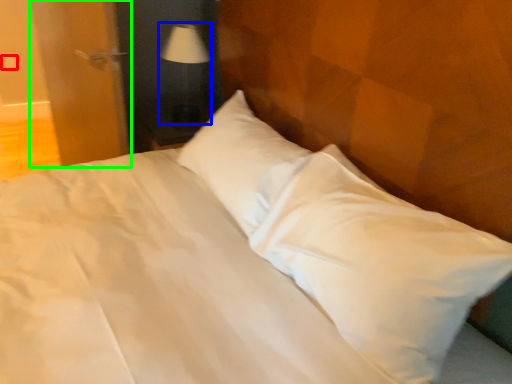
Question: Which object is positioned closest to electric outlet (highlighted by a red box)? Select from table lamp (highlighted by a blue box) and door (highlighted by a green box).

Choices:
 (A) table lamp
 (B) door

Answer: (B)